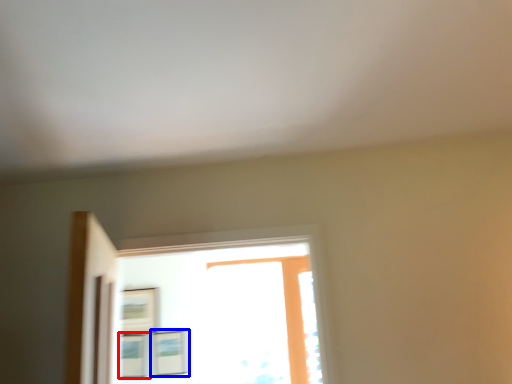
Question: Which point is closer to the camera, picture frame (highlighted by a red box) or picture frame (highlighted by a blue box)?

Choices:
 (A) picture frame
 (B) picture frame

Answer: (B)